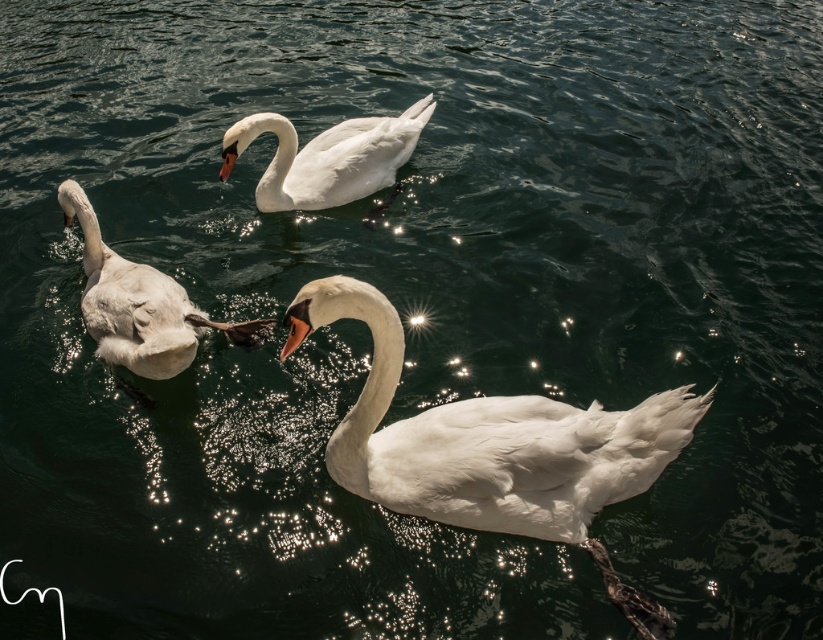
Question: Where is white feathered swan at center located in relation to white feathered swan at left in the image?

Choices:
 (A) above
 (B) below

Answer: (B)

Question: Which point is farther to the camera?

Choices:
 (A) white glossy swan at center
 (B) white feathered swan at center
 (C) white feathered swan at left

Answer: (A)

Question: Which of the following is the farthest from the observer?

Choices:
 (A) (532, 454)
 (B) (338, 161)
 (C) (146, 323)

Answer: (B)

Question: Can you confirm if white feathered swan at center is positioned above white feathered swan at left?

Choices:
 (A) no
 (B) yes

Answer: (A)

Question: Is white feathered swan at center positioned behind white feathered swan at left?

Choices:
 (A) no
 (B) yes

Answer: (A)

Question: Which object appears closest to the camera in this image?

Choices:
 (A) white glossy swan at center
 (B) white feathered swan at left
 (C) white feathered swan at center

Answer: (C)